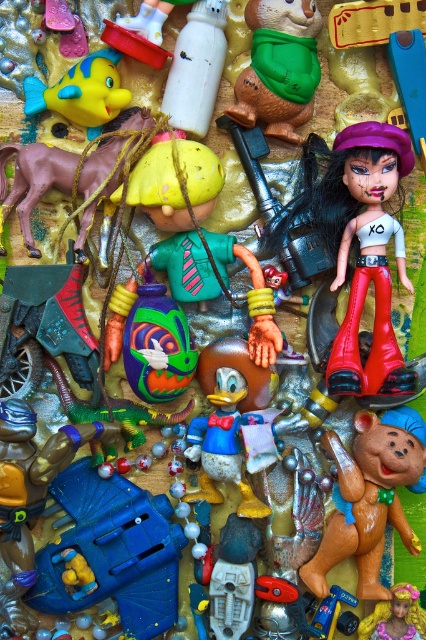
From the picture: You are a collector who wants to place a new toy between the white glossy doll at center right and the rubber yellow fish at upper left. The new toy is 10 inches long. Will there be enough space between them to fit the new toy?

The distance between the white glossy doll at center right and the rubber yellow fish at upper left is 18.69 inches. Since the new toy is 10 inches long, there is sufficient space to fit it between them.

You are organizing a toy store and need to place the white glossy doll at center right and the green rubber bear at center into a display case. Based on their positions in the image, which toy should be placed to the left side of the display case to maintain the original arrangement?

The green rubber bear at center should be placed on the left side of the display case because in the original arrangement, the white glossy doll at center right is positioned on the right side of the green rubber bear at center.

You are a photographer trying to capture a detailed shot of the robot figure. You notice two points in the scene marked as point (347, 200) and point (37, 90). Which point should you focus on to ensure the robot figure is in sharp focus?

You should focus on point (347, 200) because it is closer to the camera than point (37, 90), ensuring the robot figure is in sharp focus.